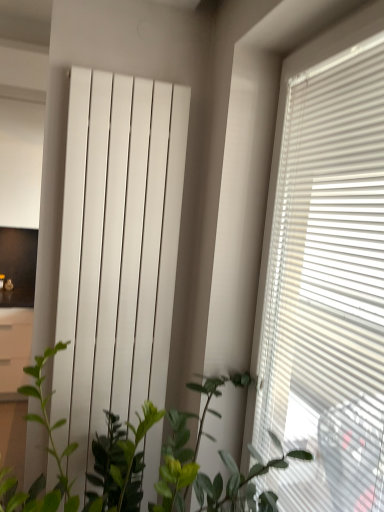
What do you see at coordinates (198, 465) in the screenshot? I see `green leafy plant at center` at bounding box center [198, 465].

In order to face white glossy file cabinet at left, should I rotate leftwards or rightwards?

You should rotate left by 22.887 degrees.

At what (x,y) coordinates should I click in order to perform the action: click on green leafy plant at center. Please return your answer as a coordinate pair (x, y). Looking at the image, I should click on (198, 465).

Could green leafy plant at center be considered to be inside white glossy radiator at center?

No, green leafy plant at center is located outside of white glossy radiator at center.

Does point (65, 280) lie behind point (229, 483)?

Yes, it is behind point (229, 483).

From the image's perspective, would you say white glossy radiator at center is shown under green leafy plant at center?

No, from the image's perspective, white glossy radiator at center is not below green leafy plant at center.

Can you confirm if green leafy plant at center is positioned to the right of white matte window blind at right?

No, green leafy plant at center is not to the right of white matte window blind at right.

Considering the sizes of objects green leafy plant at center and white matte window blind at right in the image provided, who is smaller, green leafy plant at center or white matte window blind at right?

Smaller between the two is white matte window blind at right.

Would you say green leafy plant at center is inside or outside white matte window blind at right?

green leafy plant at center lies outside white matte window blind at right.

Which is correct: white glossy file cabinet at left is inside white matte window blind at right, or outside of it?

white glossy file cabinet at left is not inside white matte window blind at right, it's outside.

Based on their positions, is white glossy file cabinet at left located to the left or right of white matte window blind at right?

Based on their positions, white glossy file cabinet at left is located to the left of white matte window blind at right.

Could you tell me if white glossy file cabinet at left is facing white matte window blind at right?

No.

Considering the relative positions of green leafy plant at center and white glossy radiator at center in the image provided, is green leafy plant at center in front of white glossy radiator at center?

Yes, the depth of green leafy plant at center is less than that of white glossy radiator at center.

From a real-world perspective, between green leafy plant at center and white glossy radiator at center, who is vertically higher?

white glossy radiator at center.

Is green leafy plant at center positioned far away from white glossy radiator at center?

No, green leafy plant at center is not far away from white glossy radiator at center.

From the image's perspective, relative to white glossy radiator at center, is green leafy plant at center above or below?

From the image's perspective, green leafy plant at center appears below white glossy radiator at center.

In the image, is white glossy radiator at center on the left side or the right side of white matte window blind at right?

white glossy radiator at center is positioned on white matte window blind at right's left side.

Are white glossy radiator at center and white matte window blind at right far apart?

That's not correct — white glossy radiator at center is a little close to white matte window blind at right.

Is white glossy radiator at center turned away from white matte window blind at right?

That's not correct — white glossy radiator at center is not looking away from white matte window blind at right.

Considering the relative sizes of white matte window blind at right and white glossy radiator at center in the image provided, is white matte window blind at right taller than white glossy radiator at center?

No.

Would you consider white matte window blind at right to be distant from white glossy radiator at center?

They are positioned close to each other.

Based on their sizes in the image, would you say white matte window blind at right is bigger or smaller than white glossy radiator at center?

Clearly, white matte window blind at right is larger in size than white glossy radiator at center.

How far apart are white matte window blind at right and white glossy radiator at center?

white matte window blind at right and white glossy radiator at center are 22.64 inches apart from each other.

Considering the positions of objects white matte window blind at right and green leafy plant at center in the image provided, who is in front, white matte window blind at right or green leafy plant at center?

Positioned in front is green leafy plant at center.

From the image's perspective, is white matte window blind at right on green leafy plant at center?

Indeed, from the image's perspective, white matte window blind at right is shown above green leafy plant at center.

Which of these two, white matte window blind at right or green leafy plant at center, is smaller?

white matte window blind at right is smaller.

Identify the location of houseplant on the right side of white glossy radiator at center. Image resolution: width=384 pixels, height=512 pixels. (198, 465).

Where is `houseplant that is below the white matte window blind at right (from the image's perspective)`? The image size is (384, 512). houseplant that is below the white matte window blind at right (from the image's perspective) is located at coordinates (198, 465).

Which object lies further to the anchor point white glossy radiator at center, white matte window blind at right or green leafy plant at center?

The object further to white glossy radiator at center is white matte window blind at right.

Based on their spatial positions, is green leafy plant at center or white matte window blind at right closer to white glossy radiator at center?

green leafy plant at center is positioned closer to the anchor white glossy radiator at center.

Looking at the image, which one is located closer to green leafy plant at center, white matte window blind at right or white glossy radiator at center?

white glossy radiator at center lies closer to green leafy plant at center than the other object.

Which object lies nearer to the anchor point white glossy radiator at center, white glossy file cabinet at left or white matte window blind at right?

white matte window blind at right is closer to white glossy radiator at center.

Consider the image. Based on their spatial positions, is white matte window blind at right or white glossy file cabinet at left closer to white glossy radiator at center?

Among the two, white matte window blind at right is located nearer to white glossy radiator at center.

From the image, which object appears to be farther from white glossy file cabinet at left, green leafy plant at center or white glossy radiator at center?

The object further to white glossy file cabinet at left is green leafy plant at center.

From the image, which object appears to be nearer to white matte window blind at right, white glossy radiator at center or green leafy plant at center?

green leafy plant at center is closer to white matte window blind at right.

Considering their positions, is white glossy radiator at center positioned further to green leafy plant at center than white glossy file cabinet at left?

The object further to green leafy plant at center is white glossy file cabinet at left.

This screenshot has height=512, width=384. What are the coordinates of `window blind located between green leafy plant at center and white glossy radiator at center in the depth direction` in the screenshot? It's located at (321, 232).

Identify the location of window blind between green leafy plant at center and white glossy file cabinet at left from front to back. (321, 232).

Find the location of `curtain between white matte window blind at right and white glossy file cabinet at left along the z-axis`. curtain between white matte window blind at right and white glossy file cabinet at left along the z-axis is located at coordinates (117, 252).

In order to click on curtain between green leafy plant at center and white glossy file cabinet at left in the front-back direction in this screenshot , I will do `click(117, 252)`.